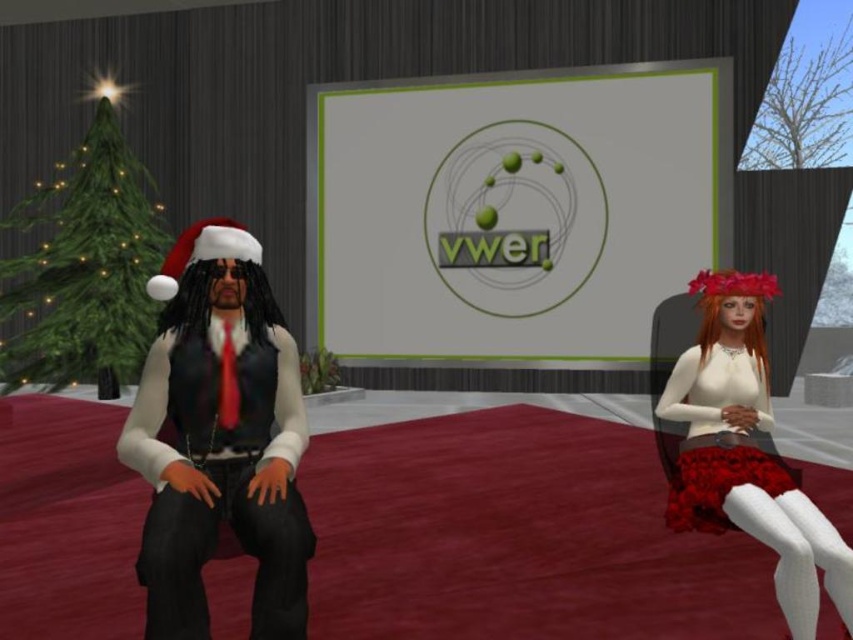
You are standing in the room where the two characters are sitting. You need to place a green matte christmas tree at left between them. Is there enough space between them to fit the tree?

The two characters are 4.33 meters apart, so there is enough space to place the green matte christmas tree at left between them.

You are planning to place a new decorative item in this scene. The item is exactly the same size as the black denim jeans at center. Can the green matte christmas tree at left accommodate this item in terms of size?

The green matte christmas tree at left is larger in size than the black denim jeans at center, so it can accommodate the decorative item of the same size as the black denim jeans at center.

You are a photographer setting up a shoot in this scene. You need to position a light source to the right of both the green matte christmas tree at left and the black denim jeans at center. Is this possible given their positions?

The green matte christmas tree at left is to the left of black denim jeans at center, so positioning a light source to the right of both would be possible as the jeans are already to the right of the tree.